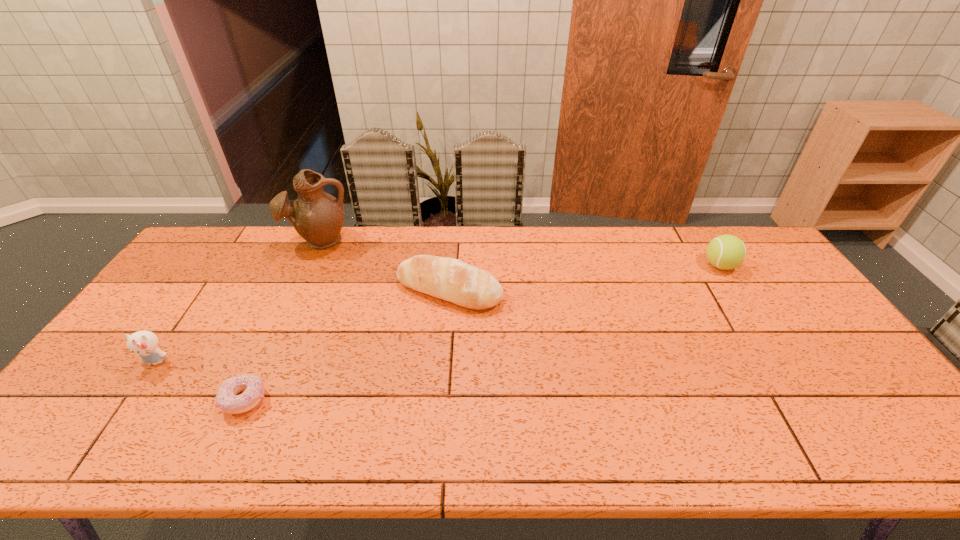
What are the coordinates of `blank space located on the right of the second object from right to left` in the screenshot? It's located at (615, 290).

Find the location of a particular element. free location located on the right of the shortest object is located at coordinates (426, 400).

Where is `pitcher positioned at the far edge`? pitcher positioned at the far edge is located at coordinates (317, 216).

Image resolution: width=960 pixels, height=540 pixels. I want to click on tennis ball located in the far edge section of the desktop, so [x=725, y=252].

Where is `bread positioned at the far edge`? The height and width of the screenshot is (540, 960). bread positioned at the far edge is located at coordinates (449, 279).

Where is `object present at the left edge`? The image size is (960, 540). object present at the left edge is located at coordinates click(x=143, y=343).

This screenshot has width=960, height=540. In order to click on object at the right edge in this screenshot , I will do `click(725, 252)`.

This screenshot has width=960, height=540. What are the coordinates of `object present at the far right corner` in the screenshot? It's located at (725, 252).

This screenshot has width=960, height=540. In the image, there is a desktop. What are the coordinates of `vacant space at the far edge` in the screenshot? It's located at (637, 253).

You are a GUI agent. You are given a task and a screenshot of the screen. Output one action in this format:
    pyautogui.click(x=<x>, y=<y>)
    Task: Click on the vacant region at the near edge of the desktop
    This screenshot has width=960, height=540.
    Given the screenshot: What is the action you would take?
    pyautogui.click(x=369, y=436)